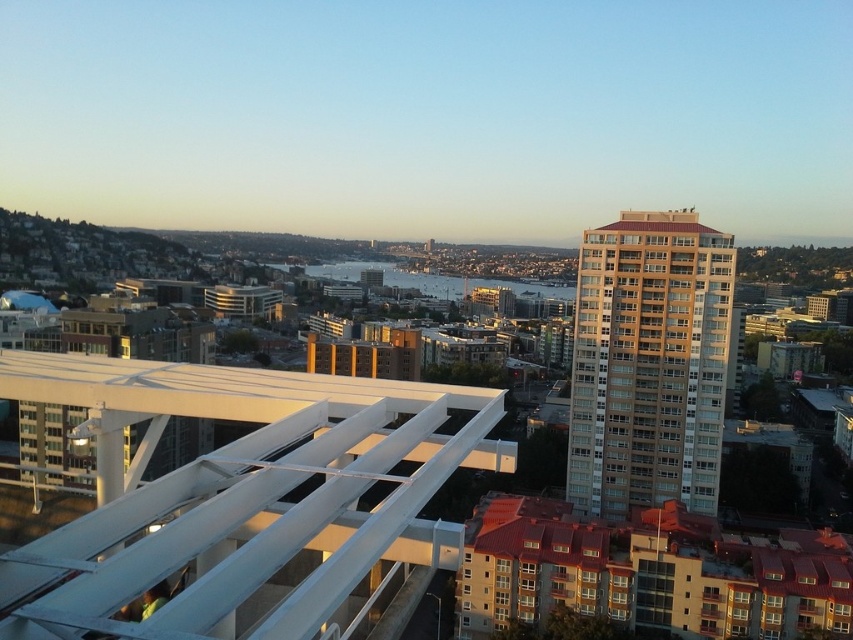
You are standing on the rooftop walkway and want to take a photo of the beige concrete building at right without the white metallic rail at center blocking the view. Is it possible to do so?

The white metallic rail at center is positioned under the beige concrete building at right, so it might block the view. However, since the rail is below the building, you could adjust your angle or position to frame the building above the rail and avoid obstruction.

You are standing on the rooftop walkway and want to take a photo of the beige concrete building at right. To avoid including the white metallic rail at center in your shot, should you move to the left or the right?

The white metallic rail at center is positioned on the left side of beige concrete building at right, so to avoid including it, you should move to the right.